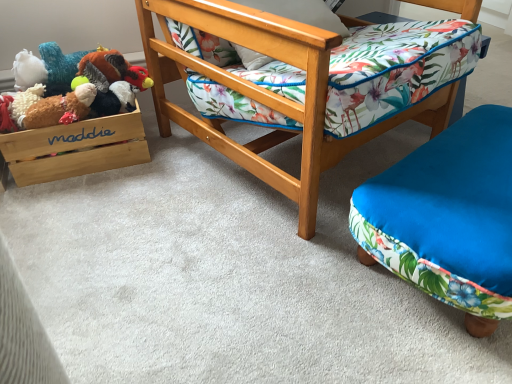
Question: Is wooden chair at center further to camera compared to fluffy brown plush at left, acting as the 1th toy starting from the bottom?

Choices:
 (A) yes
 (B) no

Answer: (B)

Question: From a real-world perspective, is wooden chair at center located higher than fluffy brown plush at left, which is the second toy in top-to-bottom order?

Choices:
 (A) yes
 (B) no

Answer: (A)

Question: Is wooden chair at center bigger than fluffy brown plush at left, acting as the 1th toy starting from the bottom?

Choices:
 (A) yes
 (B) no

Answer: (A)

Question: From the image's perspective, is wooden chair at center on fluffy brown plush at left, which is the second toy in top-to-bottom order?

Choices:
 (A) yes
 (B) no

Answer: (A)

Question: Can you confirm if wooden chair at center is taller than fluffy brown plush at left, acting as the 1th toy starting from the bottom?

Choices:
 (A) no
 (B) yes

Answer: (B)

Question: Considering the relative sizes of wooden chair at center and fluffy brown plush at left, acting as the 1th toy starting from the bottom, in the image provided, is wooden chair at center wider than fluffy brown plush at left, acting as the 1th toy starting from the bottom,?

Choices:
 (A) no
 (B) yes

Answer: (B)

Question: Is fluffy brown plush at left, acting as the 1th toy starting from the bottom, positioned behind wooden/matte storage box at left?

Choices:
 (A) no
 (B) yes

Answer: (A)

Question: From a real-world perspective, is fluffy brown plush at left, acting as the 1th toy starting from the bottom, located beneath wooden/matte storage box at left?

Choices:
 (A) yes
 (B) no

Answer: (B)

Question: Is fluffy brown plush at left, acting as the 1th toy starting from the bottom, thinner than wooden/matte storage box at left?

Choices:
 (A) yes
 (B) no

Answer: (A)

Question: From a real-world perspective, is fluffy brown plush at left, which is the second toy in top-to-bottom order, on wooden/matte storage box at left?

Choices:
 (A) yes
 (B) no

Answer: (A)

Question: Is fluffy brown plush at left, which is the second toy in top-to-bottom order, facing towards wooden/matte storage box at left?

Choices:
 (A) no
 (B) yes

Answer: (A)

Question: Is there a large distance between fluffy brown plush at left, which is the second toy in top-to-bottom order, and wooden/matte storage box at left?

Choices:
 (A) yes
 (B) no

Answer: (B)

Question: Considering the relative sizes of wooden chair at center and wooden/matte storage box at left in the image provided, is wooden chair at center bigger than wooden/matte storage box at left?

Choices:
 (A) no
 (B) yes

Answer: (B)